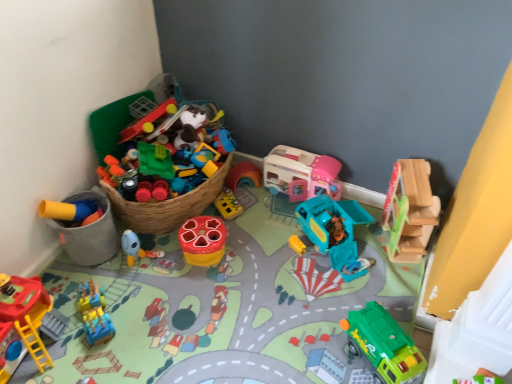
This screenshot has width=512, height=384. I want to click on vacant space behind rubberized plastic toy at center, positioned as the fourth toy in left-to-right order, so click(x=230, y=213).